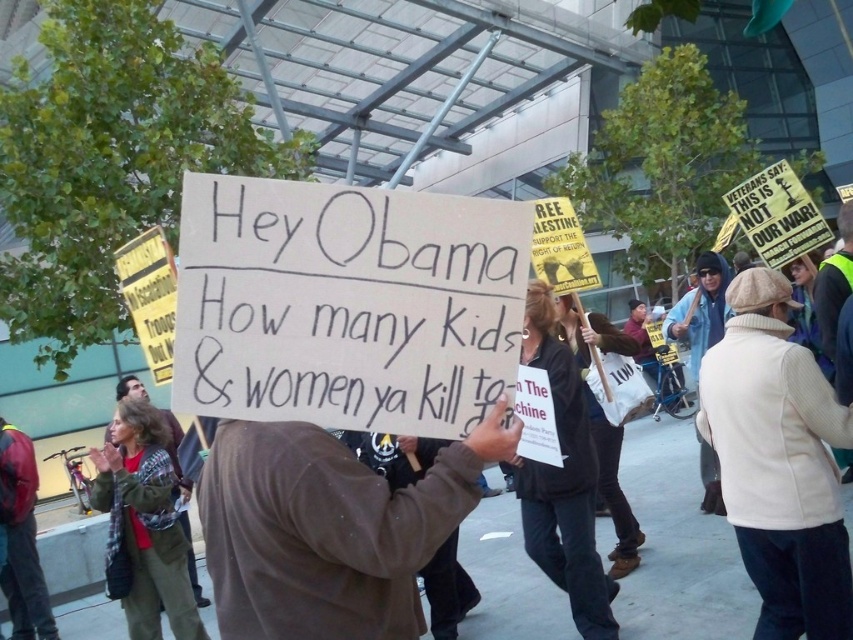
You are a photographer trying to capture a shot of both the dark brown leather jacket at lower left and the green plaid shirt at center. Based on their sizes in the image, which one should you focus on first to ensure they both fit in the frame?

The dark brown leather jacket at lower left is not as tall as the green plaid shirt at center, so you should focus on the green plaid shirt at center first to ensure both fit in the frame.